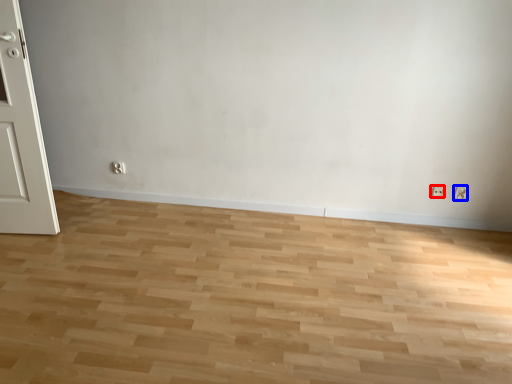
Question: Among these objects, which one is farthest to the camera, electric outlet (highlighted by a red box) or electric outlet (highlighted by a blue box)?

Choices:
 (A) electric outlet
 (B) electric outlet

Answer: (A)